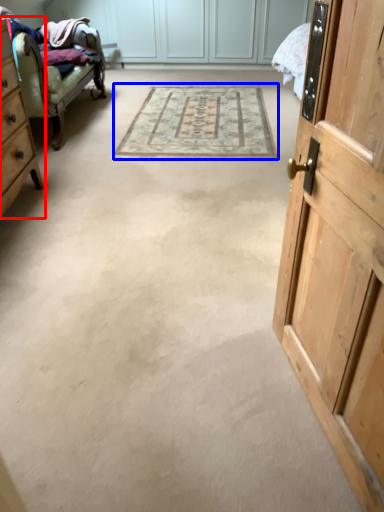
Question: Among these objects, which one is farthest to the camera, cabinetry (highlighted by a red box) or mat (highlighted by a blue box)?

Choices:
 (A) cabinetry
 (B) mat

Answer: (B)